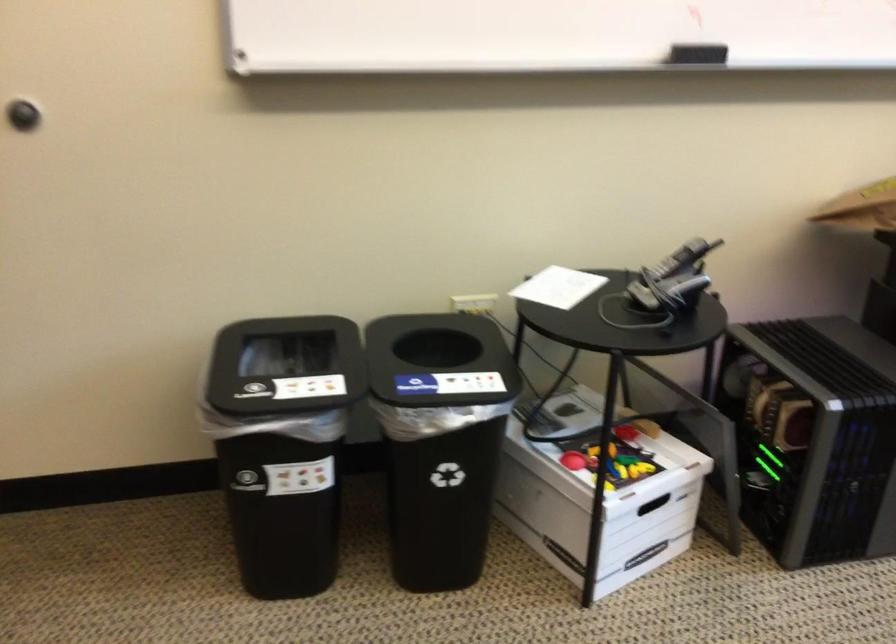
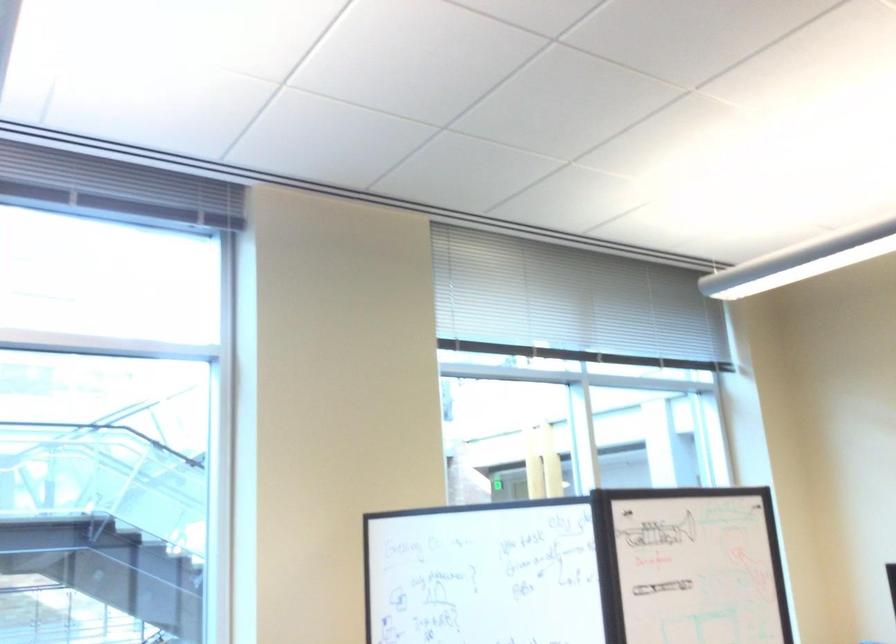
Question: The camera is either moving clockwise (left) or counter-clockwise (right) around the object. The first image is from the beginning of the video and the second image is from the end. Is the camera moving left or right when shooting the video?

Choices:
 (A) Left
 (B) Right

Answer: (A)